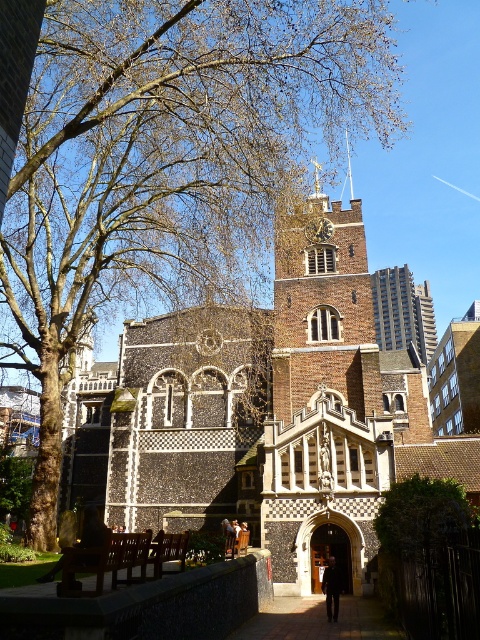
You are standing in front of the historic building and see both the dark wool coat at center and the gold textured clock at center. Which object is nearer to you?

The dark wool coat at center is closer to the viewer than the gold textured clock at center.

You are standing in front of the historic building and notice two objects at the center. Which one is higher up between the brown brick tower at center and the dark wool coat at center?

The brown brick tower at center is higher up than the dark wool coat at center because it is positioned above it.